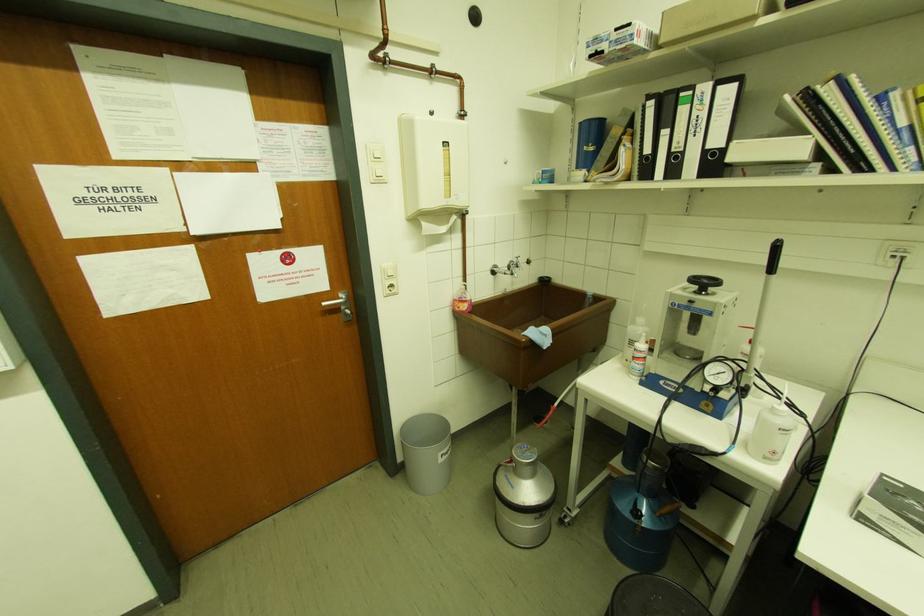
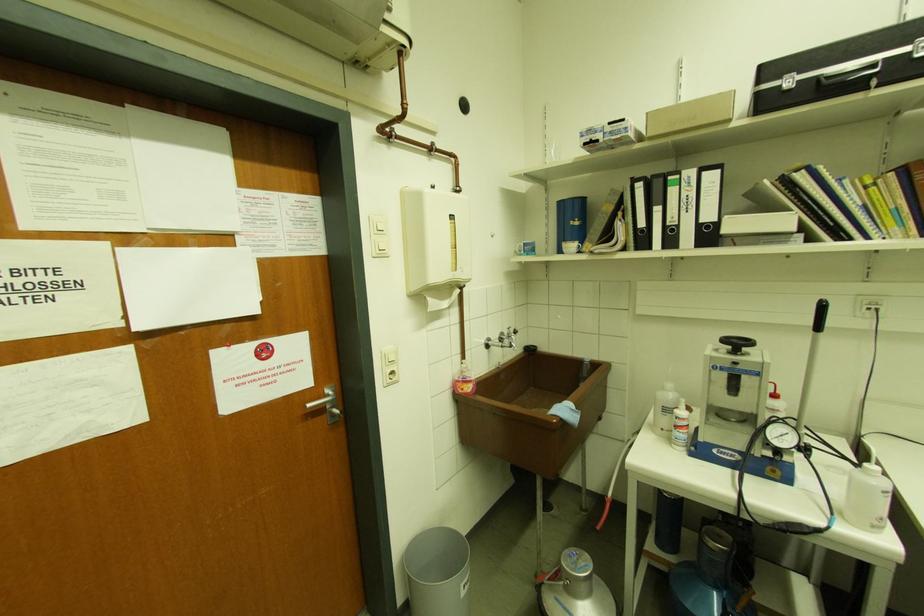
The images are taken continuously from a first-person perspective. In which direction are you moving?

The movement direction of the cameraman is left, forward.